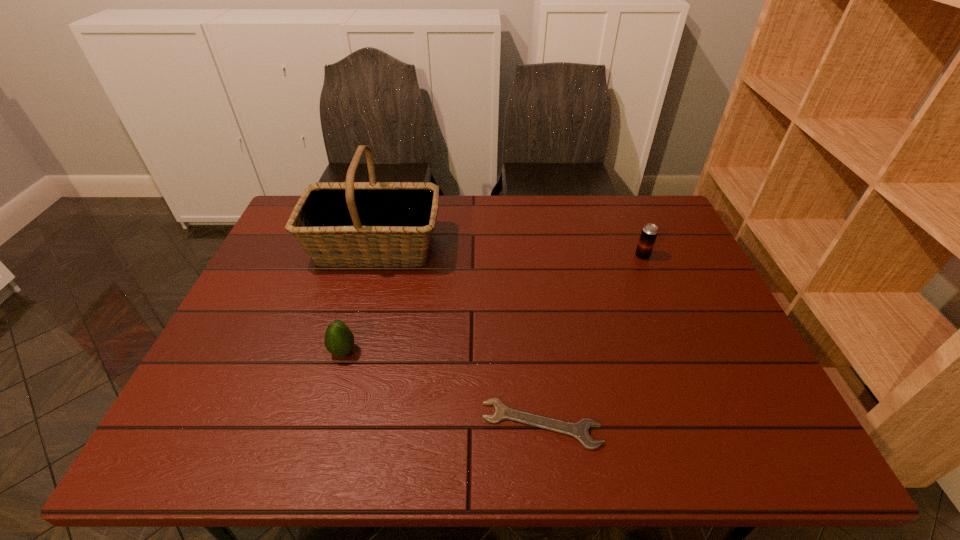
Where is `the tallest object`? The width and height of the screenshot is (960, 540). the tallest object is located at coordinates pos(338,224).

Find the location of `beer can`. beer can is located at coordinates (649, 232).

Where is `the second nearest object`? The height and width of the screenshot is (540, 960). the second nearest object is located at coordinates (339, 340).

In order to click on the second object from right to left in this screenshot , I will do `click(580, 430)`.

The height and width of the screenshot is (540, 960). In order to click on the shortest object in this screenshot , I will do click(580, 430).

Locate an element on the screen. vacant space located 0.070m by the handle of the tallest object is located at coordinates (464, 247).

Where is `free location located 0.070m on the left of the rightmost object`? free location located 0.070m on the left of the rightmost object is located at coordinates (612, 256).

The height and width of the screenshot is (540, 960). Identify the location of vacant space located on the front of the avocado. [x=332, y=389].

Identify the location of vacant space located on the right of the nearest object. This screenshot has width=960, height=540. (696, 424).

Locate an element on the screen. This screenshot has width=960, height=540. object that is at the far edge is located at coordinates (338, 224).